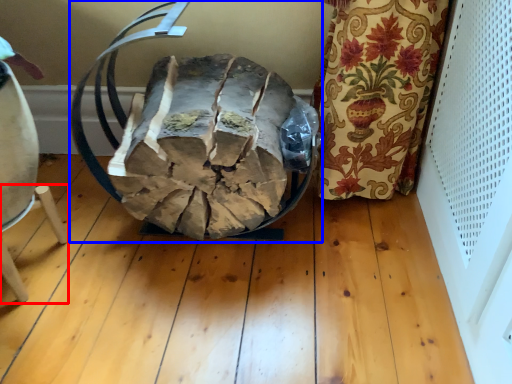
Question: Which of the following is the farthest to the observer, furniture (highlighted by a red box) or bean bag chair (highlighted by a blue box)?

Choices:
 (A) furniture
 (B) bean bag chair

Answer: (A)